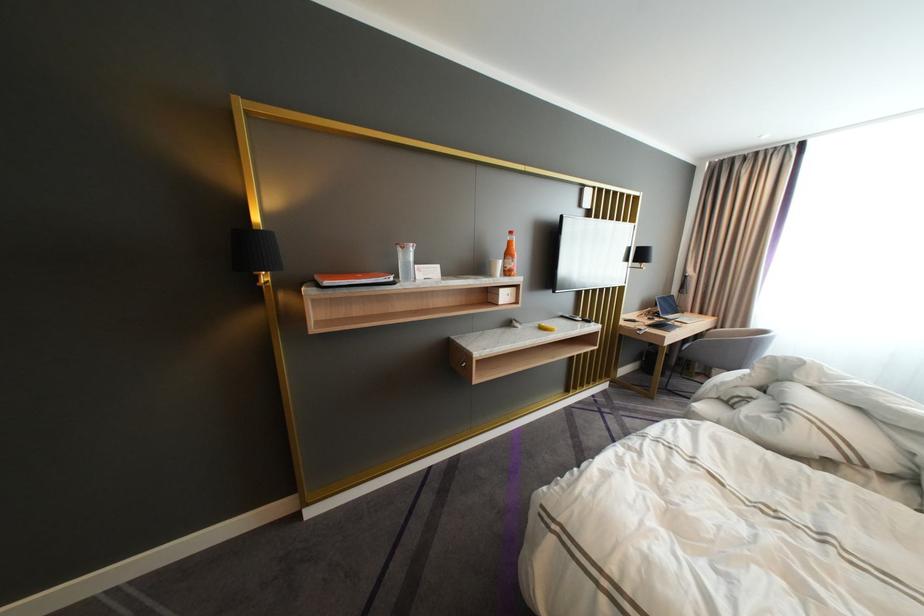
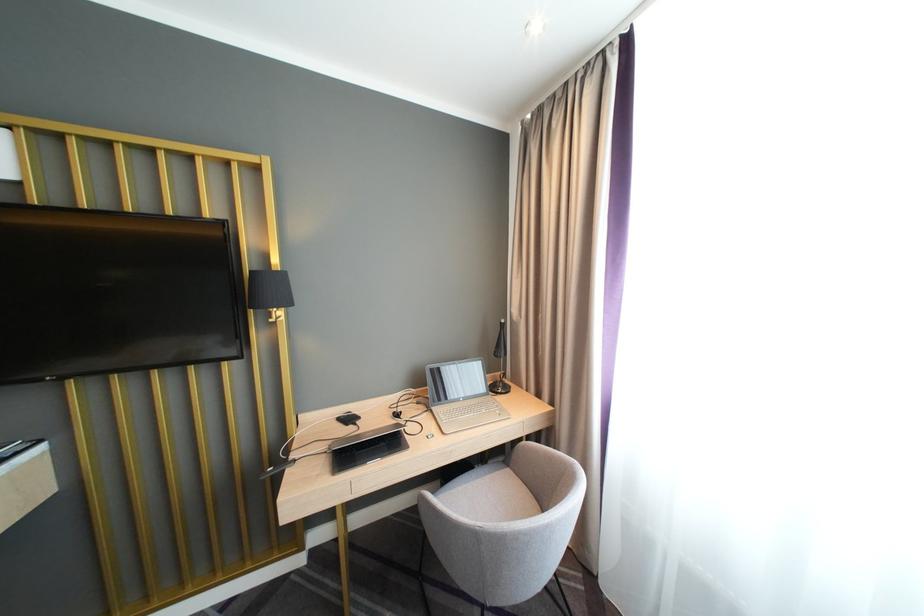
What movement of the cameraman would produce the second image?

The cameraman walked toward right, forward.